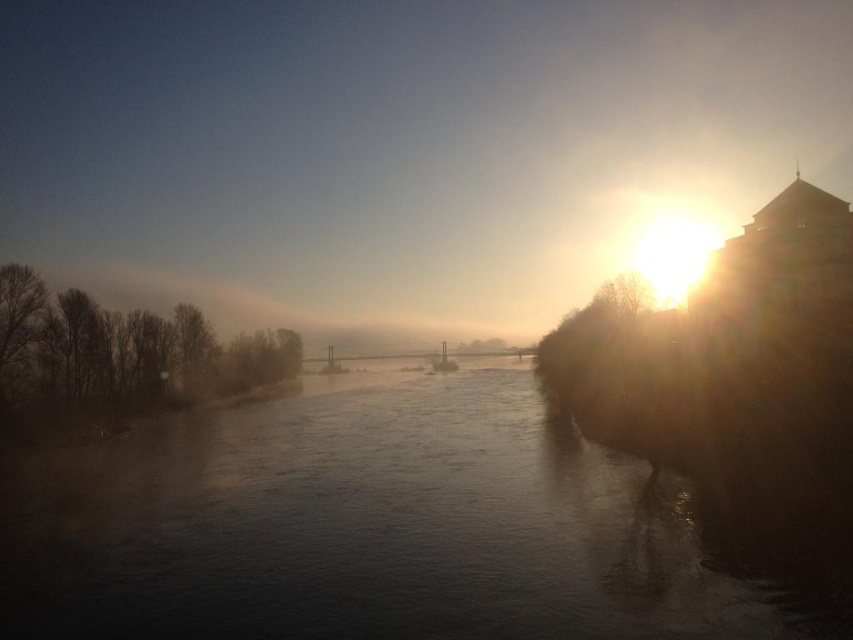
Question: Can you confirm if foggy mist at river center is positioned to the left of dark water at center?

Choices:
 (A) no
 (B) yes

Answer: (A)

Question: Considering the relative positions of foggy mist at river center and dark water at center in the image provided, where is foggy mist at river center located with respect to dark water at center?

Choices:
 (A) above
 (B) below

Answer: (A)

Question: Which object appears farthest from the camera in this image?

Choices:
 (A) foggy mist at river center
 (B) dark water at center

Answer: (A)

Question: Which of the following is the farthest from the observer?

Choices:
 (A) dark water at center
 (B) foggy mist at river center

Answer: (B)

Question: Is foggy mist at river center thinner than dark water at center?

Choices:
 (A) no
 (B) yes

Answer: (A)